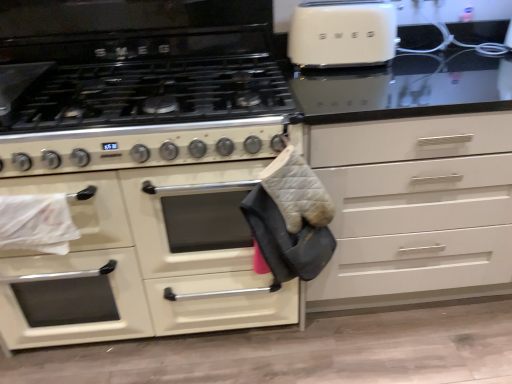
What is the approximate height of matte white oven at center?

It is 30.31 inches.

The width and height of the screenshot is (512, 384). What do you see at coordinates (420, 207) in the screenshot? I see `white matte drawer at center` at bounding box center [420, 207].

What is the approximate width of white matte drawer at center?

white matte drawer at center is 25.68 inches wide.

At what (x,y) coordinates should I click in order to perform the action: click on gray quilted oven mitt at center. Please return your answer as a coordinate pair (x, y). This screenshot has width=512, height=384. Looking at the image, I should click on (290, 219).

What are the coordinates of `cabinetry below the white matte drawer at center (from the image's perspective)` in the screenshot? It's located at (139, 164).

Is matte white oven at center at the back of white matte drawer at center?

No, white matte drawer at center is not facing the opposite direction of matte white oven at center.

Which object is positioned more to the left, white matte drawer at center or matte white oven at center?

From the viewer's perspective, matte white oven at center appears more on the left side.

From the image's perspective, who appears lower, white matte drawer at center or matte white oven at center?

matte white oven at center.

From the image's perspective, is matte white oven at center located above white matte drawer at center?

No.

Are matte white oven at center and white matte drawer at center making contact?

No, matte white oven at center is not next to white matte drawer at center.

Measure the distance between matte white oven at center and white matte drawer at center.

54.45 centimeters.

Would you say matte white oven at center is to the left or to the right of white matte drawer at center in the picture?

In the image, matte white oven at center appears on the left side of white matte drawer at center.

Is white matte drawer at center beside gray quilted oven mitt at center?

No, white matte drawer at center is not in contact with gray quilted oven mitt at center.

From the image's perspective, which one is positioned lower, white matte drawer at center or gray quilted oven mitt at center?

gray quilted oven mitt at center is shown below in the image.

Is white matte drawer at center to the left of gray quilted oven mitt at center from the viewer's perspective?

Incorrect, white matte drawer at center is not on the left side of gray quilted oven mitt at center.

Considering the points (360, 290) and (244, 202), which point is behind, point (360, 290) or point (244, 202)?

Positioned behind is point (360, 290).

In terms of width, does matte white oven at center look wider or thinner when compared to gray quilted oven mitt at center?

matte white oven at center is wider than gray quilted oven mitt at center.

Looking at this image, is matte white oven at center aimed at gray quilted oven mitt at center?

Yes, matte white oven at center is oriented towards gray quilted oven mitt at center.

Is matte white oven at center with gray quilted oven mitt at center?

They are not placed beside each other.

From a real-world perspective, between matte white oven at center and gray quilted oven mitt at center, who is vertically lower?

matte white oven at center is physically lower.

Which of these two, gray quilted oven mitt at center or white matte drawer at center, is wider?

With larger width is white matte drawer at center.

Consider the image. Between gray quilted oven mitt at center and white matte drawer at center, which one has more height?

Standing taller between the two is white matte drawer at center.

Is point (304, 257) positioned before point (475, 155)?

Yes, point (304, 257) is in front of point (475, 155).

Does gray quilted oven mitt at center have a smaller size compared to matte white oven at center?

Correct, gray quilted oven mitt at center occupies less space than matte white oven at center.

Do you think gray quilted oven mitt at center is within matte white oven at center, or outside of it?

gray quilted oven mitt at center is spatially situated outside matte white oven at center.

Is gray quilted oven mitt at center touching matte white oven at center?

gray quilted oven mitt at center is not next to matte white oven at center, and they're not touching.

From the image's perspective, does gray quilted oven mitt at center appear higher than matte white oven at center?

Yes.

Image resolution: width=512 pixels, height=384 pixels. Find the location of `cabinetry on the left of white matte drawer at center`. cabinetry on the left of white matte drawer at center is located at coordinates (139, 164).

At what (x,y) coordinates should I click in order to perform the action: click on cabinetry that is below the white matte drawer at center (from the image's perspective). Please return your answer as a coordinate pair (x, y). The width and height of the screenshot is (512, 384). Looking at the image, I should click on (139, 164).

When comparing their distances from gray quilted oven mitt at center, does white matte drawer at center or matte white oven at center seem closer?

white matte drawer at center.

Looking at the image, which one is located closer to white matte drawer at center, matte white oven at center or gray quilted oven mitt at center?

gray quilted oven mitt at center is positioned closer to the anchor white matte drawer at center.

Considering their positions, is gray quilted oven mitt at center positioned further to white matte drawer at center than matte white oven at center?

matte white oven at center is positioned further to the anchor white matte drawer at center.

Which object lies further to the anchor point matte white oven at center, gray quilted oven mitt at center or white matte drawer at center?

white matte drawer at center is further to matte white oven at center.

When comparing their distances from matte white oven at center, does white matte drawer at center or gray quilted oven mitt at center seem further?

white matte drawer at center lies further to matte white oven at center than the other object.

When comparing their distances from gray quilted oven mitt at center, does matte white oven at center or white matte drawer at center seem closer?

white matte drawer at center lies closer to gray quilted oven mitt at center than the other object.

Find the location of a particular element. This screenshot has height=384, width=512. material between matte white oven at center and white matte drawer at center in the horizontal direction is located at coordinates (290, 219).